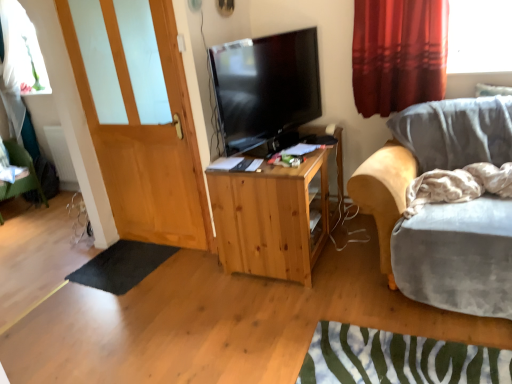
You are a GUI agent. You are given a task and a screenshot of the screen. Output one action in this format:
    pyautogui.click(x=<x>, y=<y>)
    Task: Click on the free location in front of natural wood cabinet at center
    Image resolution: width=512 pixels, height=384 pixels.
    Given the screenshot: What is the action you would take?
    pyautogui.click(x=285, y=315)